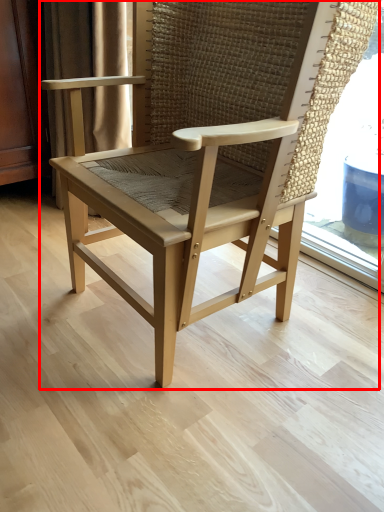
Question: From the image's perspective, where is chair (annotated by the red box) located in relation to curtain in the image?

Choices:
 (A) below
 (B) above

Answer: (A)